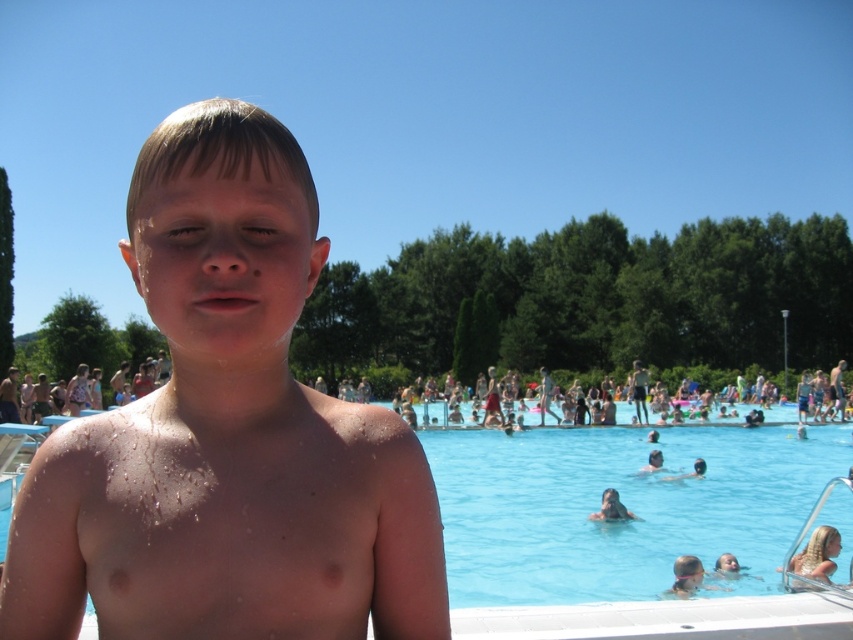
Who is shorter, blue smooth water at center or smooth skin child at center?

smooth skin child at center is shorter.

Image resolution: width=853 pixels, height=640 pixels. I want to click on blue smooth water at center, so click(631, 529).

Where is `blue smooth water at center`? This screenshot has width=853, height=640. blue smooth water at center is located at coordinates (631, 529).

Does shiny wet skin at center appear on the right side of blue smooth water at center?

No, shiny wet skin at center is not to the right of blue smooth water at center.

Which is above, shiny wet skin at center or blue smooth water at center?

shiny wet skin at center is above.

Is point (387, 509) less distant than point (838, 576)?

Yes, it is.

The image size is (853, 640). Find the location of `shiny wet skin at center`. shiny wet skin at center is located at coordinates (227, 433).

How much distance is there between shiny wet skin at center and smooth skin child at center?

shiny wet skin at center and smooth skin child at center are 11.08 meters apart from each other.

Is point (375, 428) farther from camera compared to point (601, 515)?

No, (375, 428) is in front of (601, 515).

Image resolution: width=853 pixels, height=640 pixels. I want to click on shiny wet skin at center, so click(227, 433).